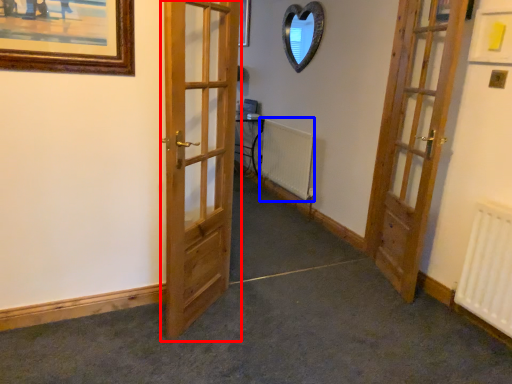
Question: Which of the following is the farthest to the observer, door (highlighted by a red box) or radiator (highlighted by a blue box)?

Choices:
 (A) door
 (B) radiator

Answer: (B)